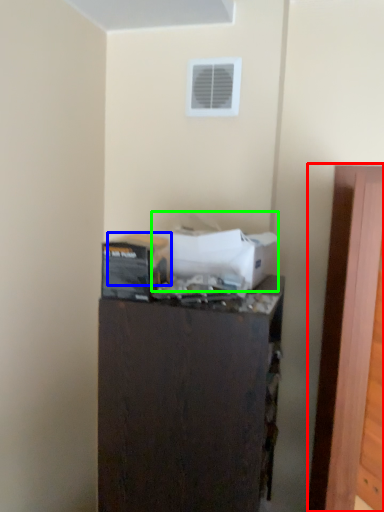
Question: Considering the real-world distances, which object is farthest from door (highlighted by a red box)? box (highlighted by a blue box) or box (highlighted by a green box)?

Choices:
 (A) box
 (B) box

Answer: (A)